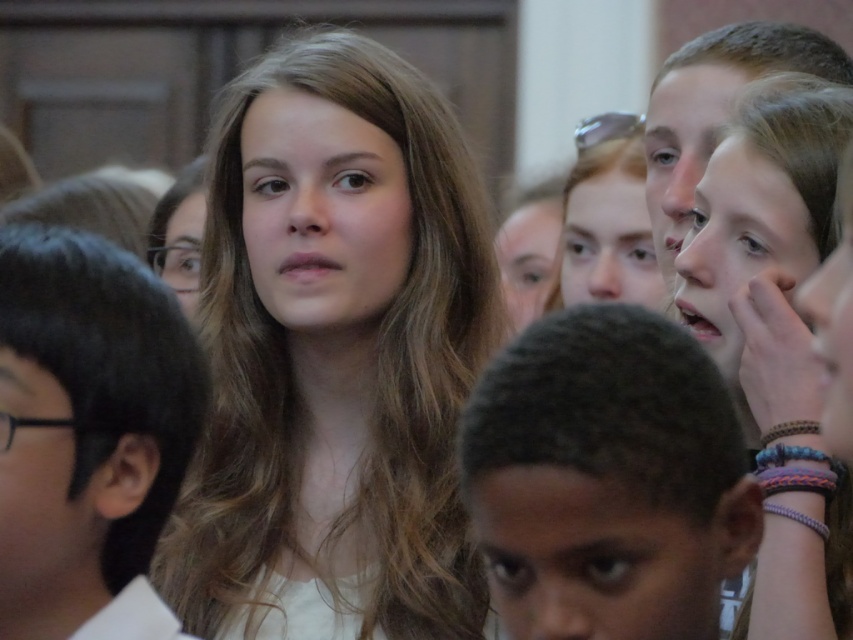
This screenshot has width=853, height=640. Describe the element at coordinates (335, 356) in the screenshot. I see `smooth brown hair at center` at that location.

Based on the photo, who is positioned more to the left, smooth brown hair at center or dark brown hair at center?

Positioned to the left is smooth brown hair at center.

From the picture: Measure the distance between point (320, 186) and camera.

Point (320, 186) and camera are 17.28 feet apart from each other.

The height and width of the screenshot is (640, 853). Find the location of `smooth brown hair at center`. smooth brown hair at center is located at coordinates (335, 356).

This screenshot has width=853, height=640. Describe the element at coordinates (606, 480) in the screenshot. I see `dark brown hair at center` at that location.

Which of these two, dark brown hair at center or black hair at center, stands taller?

Standing taller between the two is black hair at center.

Does point (618, 541) lie behind point (80, 566)?

That is False.

You are a GUI agent. You are given a task and a screenshot of the screen. Output one action in this format:
    pyautogui.click(x=<x>, y=<y>)
    Task: Click on the dark brown hair at center
    The image size is (853, 640).
    Given the screenshot: What is the action you would take?
    pyautogui.click(x=606, y=480)

Can you confirm if smooth brown hair at center is smaller than black hair at center?

Incorrect, smooth brown hair at center is not smaller in size than black hair at center.

Measure the distance between point (386,435) and camera.

5.37 meters

The image size is (853, 640). What are the coordinates of `smooth brown hair at center` in the screenshot? It's located at (335, 356).